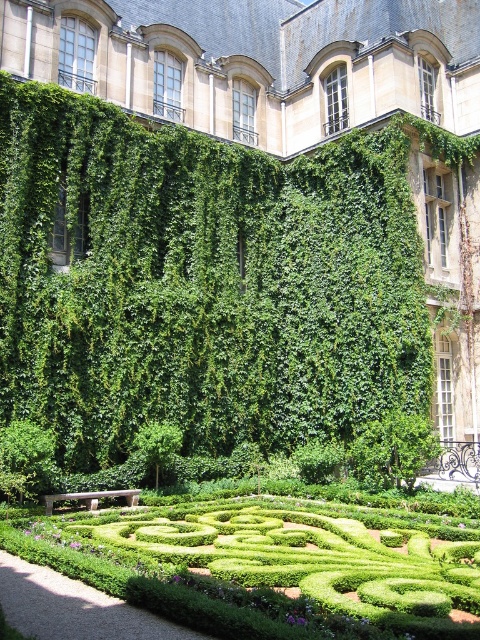
You are a landscape architect designing a new garden. You have a drone that can fly 18 meters. You need to fly it from the green hedge maze at center to the green leafy bush at center. Can your drone make the trip without needing to recharge?

The green hedge maze at center and green leafy bush at center are 17.66 meters apart from each other. Since the drone can fly 18 meters, it can make the trip without needing to recharge.

You are a gardener who wants to plant a new row of flowers between the green hedge maze at center and the green leafy bush at center. Which side should you plant the flowers to ensure they have enough space to grow without overcrowding the smaller plant?

You should plant the flowers on the side of the green hedge maze at center because its width is greater than the green leafy bush at center, providing more space for the flowers to grow without overcrowding the smaller plant.